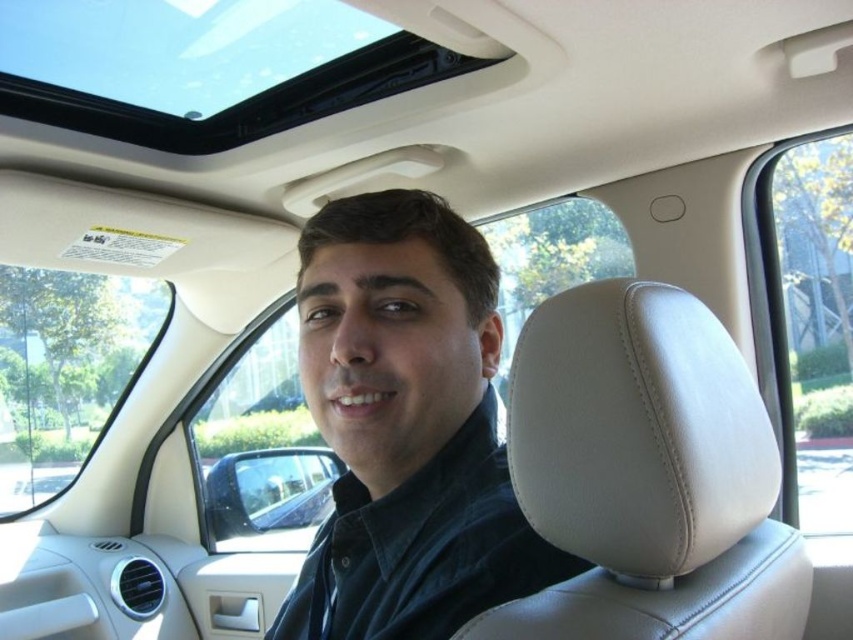
You are sitting in the passenger seat of the car and want to place a small keychain on the beige leather headrest at center. Based on the coordinates provided, can you determine if the headrest is positioned in the central area of the car?

The beige leather headrest at center is located at coordinates point (646, 474), which places it in the central area of the car.

You are sitting in the passenger seat of the car and want to reach a button located at point (727,630) and another button at point (488,461). Which button is closer to you?

Point (488,461) is closer to you because it is behind point (727,630), meaning the latter is further away.